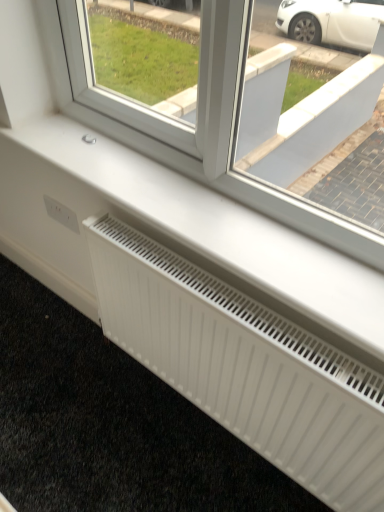
Find the location of a particular element. The width and height of the screenshot is (384, 512). vacant area situated below white matte radiator at lower center (from a real-world perspective) is located at coordinates (213, 432).